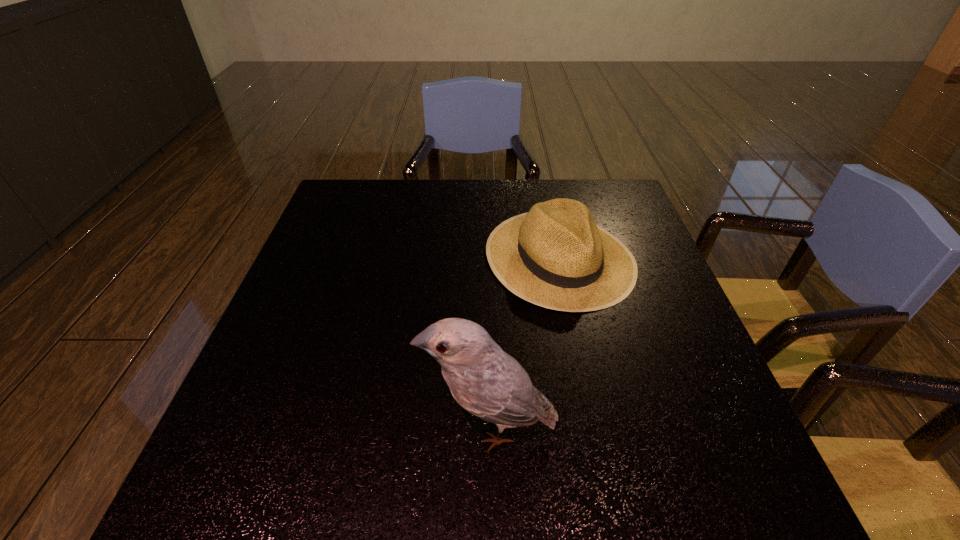
Identify the location of parrot. The height and width of the screenshot is (540, 960). click(483, 379).

Identify the location of the nearer object. The image size is (960, 540). (483, 379).

The height and width of the screenshot is (540, 960). I want to click on the farther object, so click(x=555, y=256).

What are the coordinates of `the shorter object` in the screenshot? It's located at 555,256.

Identify the location of blank space located on the front-facing side of the nearer object. This screenshot has width=960, height=540. (329, 427).

What are the coordinates of `vacant area situated 0.240m on the front-facing side of the nearer object` in the screenshot? It's located at (291, 427).

The image size is (960, 540). I want to click on vacant region located 0.170m on the front-facing side of the nearer object, so coord(329,427).

I want to click on vacant point located 0.060m on the back of the shorter object, so click(x=548, y=203).

Identify the location of object that is at the far edge. (555, 256).

Image resolution: width=960 pixels, height=540 pixels. I want to click on object that is at the right edge, so click(x=555, y=256).